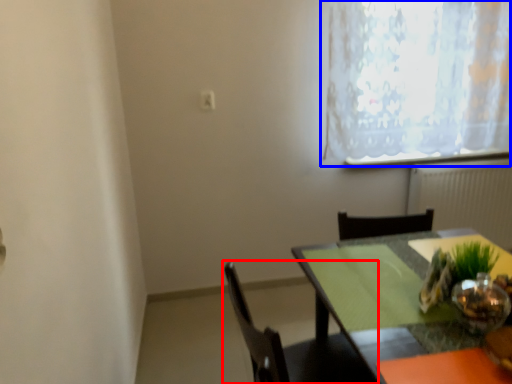
Question: Which point is closer to the camera, chair (highlighted by a red box) or window (highlighted by a blue box)?

Choices:
 (A) chair
 (B) window

Answer: (A)